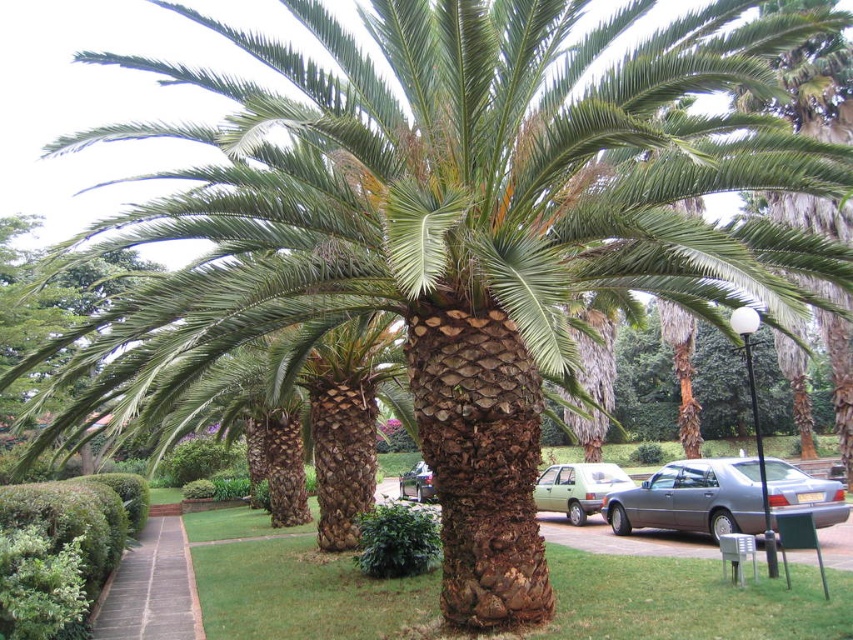
Does brown brick pavement at lower left appear over metallic silver sedan at center?

Indeed, brown brick pavement at lower left is positioned over metallic silver sedan at center.

The width and height of the screenshot is (853, 640). What are the coordinates of `brown brick pavement at lower left` in the screenshot? It's located at (151, 588).

Does brown brick pavement at lower left lie behind green matte sedan at center?

Yes.

Who is positioned more to the left, brown brick pavement at lower left or green matte sedan at center?

From the viewer's perspective, brown brick pavement at lower left appears more on the left side.

This screenshot has height=640, width=853. I want to click on brown brick pavement at lower left, so click(151, 588).

At what (x,y) coordinates should I click in order to perform the action: click on brown brick pavement at lower left. Please return your answer as a coordinate pair (x, y). The width and height of the screenshot is (853, 640). Looking at the image, I should click on (151, 588).

Can you confirm if metallic gray sedan at center is thinner than metallic silver sedan at center?

No.

The image size is (853, 640). Describe the element at coordinates (692, 499) in the screenshot. I see `metallic gray sedan at center` at that location.

Identify the location of metallic gray sedan at center. This screenshot has width=853, height=640. (692, 499).